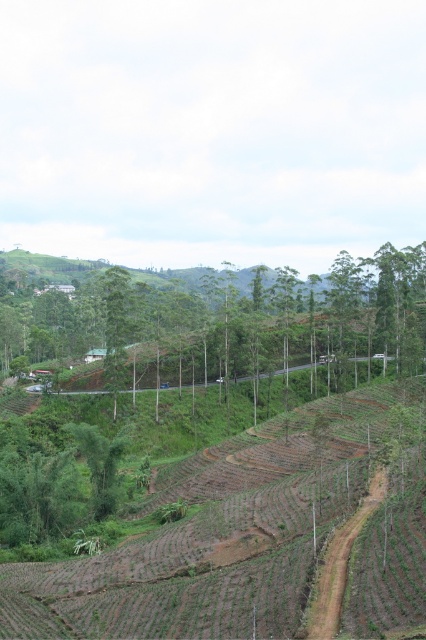
Question: Is the position of green leafy tree at center more distant than that of brown dirt track at center-right?

Choices:
 (A) yes
 (B) no

Answer: (A)

Question: Considering the relative positions of green leafy tree at center and brown dirt track at center-right in the image provided, where is green leafy tree at center located with respect to brown dirt track at center-right?

Choices:
 (A) right
 (B) left

Answer: (B)

Question: Is green leafy tree at center above brown dirt track at center-right?

Choices:
 (A) yes
 (B) no

Answer: (A)

Question: Which point appears farthest from the camera in this image?

Choices:
 (A) (256, 340)
 (B) (348, 522)

Answer: (A)